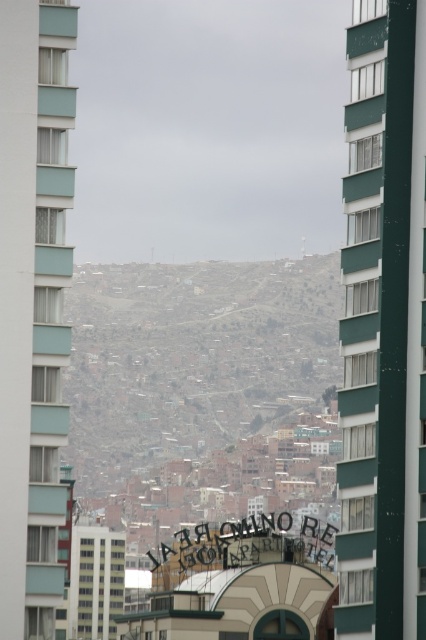
Looking at this image, you are standing at the center of the urban area looking towards the two points marked in the image. Which point, point (63, 45) or point (74, 634), is closer to you?

Point (63, 45) is closer to the camera than point (74, 634), so it is closer to you.